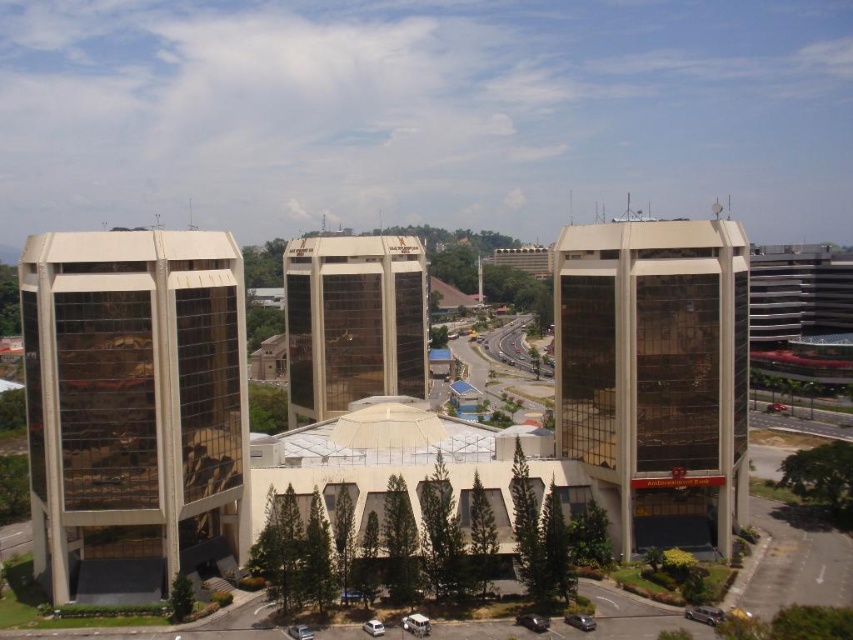
Question: Which object is farther from the camera taking this photo?

Choices:
 (A) gold reflective glass building at center
 (B) matte glass building at center
 (C) gold reflective glass building at left

Answer: (A)

Question: Among these points, which one is nearest to the camera?

Choices:
 (A) (573, 451)
 (B) (67, 531)

Answer: (B)

Question: Is matte glass building at center below gold reflective glass building at center?

Choices:
 (A) yes
 (B) no

Answer: (B)

Question: Which object appears farthest from the camera in this image?

Choices:
 (A) gold reflective glass building at left
 (B) gold reflective glass building at center

Answer: (B)

Question: Is matte glass building at center thinner than gold reflective glass building at center?

Choices:
 (A) no
 (B) yes

Answer: (B)

Question: Is gold reflective glass building at left to the left of matte glass building at center from the viewer's perspective?

Choices:
 (A) no
 (B) yes

Answer: (B)